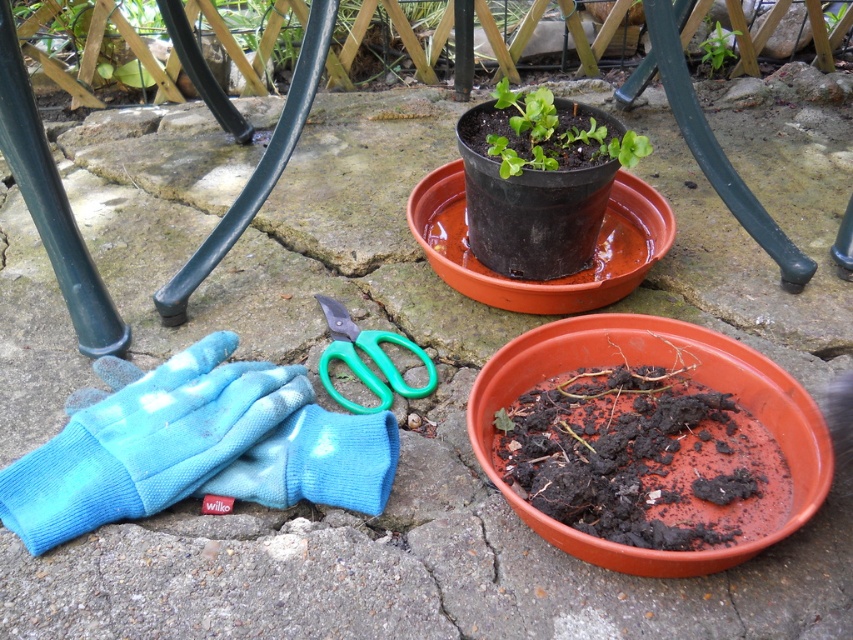
Based on the photo, you are a gardener who wants to place the green matte plant at upper center into a container. The container you have is the same size as the blue fabric glove at lower left. Will the plant fit?

The blue fabric glove at lower left is wider than the green matte plant at upper center, so the plant will fit into the container.

You are a gardener who wants to move the green matte plant at upper center closer to the blue fabric glove at lower left. Which direction should you move it?

The blue fabric glove at lower left is to the left of the green matte plant at upper center, so you should move the green matte plant at upper center to the left to bring it closer to the blue fabric glove at lower left.